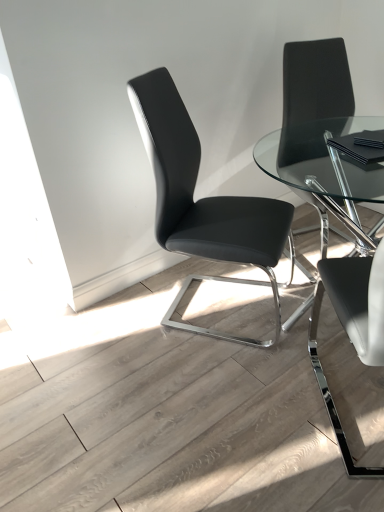
Question: From a real-world perspective, is black leather chair at upper right, marked as the 3th chair in a left-to-right arrangement, under black leather chair at right, the second chair in the left-to-right sequence?

Choices:
 (A) yes
 (B) no

Answer: (B)

Question: Is black leather chair at upper right, which appears as the first chair when viewed from the right, outside of black leather chair at right, which is counted as the second chair, starting from the right?

Choices:
 (A) yes
 (B) no

Answer: (A)

Question: Can you confirm if black leather chair at upper right, which appears as the first chair when viewed from the right, is positioned to the left of black leather chair at right, the second chair in the left-to-right sequence?

Choices:
 (A) no
 (B) yes

Answer: (A)

Question: Could you tell me if black leather chair at upper right, which appears as the first chair when viewed from the right, is turned towards black leather chair at right, which is counted as the second chair, starting from the right?

Choices:
 (A) no
 (B) yes

Answer: (A)

Question: From the image's perspective, does black leather chair at upper right, which appears as the first chair when viewed from the right, appear higher than black leather chair at right, which is counted as the second chair, starting from the right?

Choices:
 (A) no
 (B) yes

Answer: (B)

Question: Is black leather chair at upper right, which appears as the first chair when viewed from the right, positioned behind black leather chair at right, which is counted as the second chair, starting from the right?

Choices:
 (A) no
 (B) yes

Answer: (B)

Question: Is black leather chair at right, the second chair in the left-to-right sequence, bigger than black leather chair at center, which ranks as the 1th chair in left-to-right order?

Choices:
 (A) no
 (B) yes

Answer: (A)

Question: Is black leather chair at right, which is counted as the second chair, starting from the right, shorter than black leather chair at center, the 3th chair from the right?

Choices:
 (A) no
 (B) yes

Answer: (B)

Question: Can you confirm if black leather chair at right, which is counted as the second chair, starting from the right, is smaller than black leather chair at center, the 3th chair from the right?

Choices:
 (A) no
 (B) yes

Answer: (B)

Question: From the image's perspective, is black leather chair at right, the second chair in the left-to-right sequence, beneath black leather chair at center, which ranks as the 1th chair in left-to-right order?

Choices:
 (A) yes
 (B) no

Answer: (A)

Question: Does black leather chair at right, the second chair in the left-to-right sequence, lie behind black leather chair at center, the 3th chair from the right?

Choices:
 (A) no
 (B) yes

Answer: (A)

Question: Is black leather chair at right, which is counted as the second chair, starting from the right, aimed at black leather chair at center, the 3th chair from the right?

Choices:
 (A) yes
 (B) no

Answer: (B)

Question: Is black leather chair at center, the 3th chair from the right, further to camera compared to black leather chair at upper right, marked as the 3th chair in a left-to-right arrangement?

Choices:
 (A) no
 (B) yes

Answer: (A)